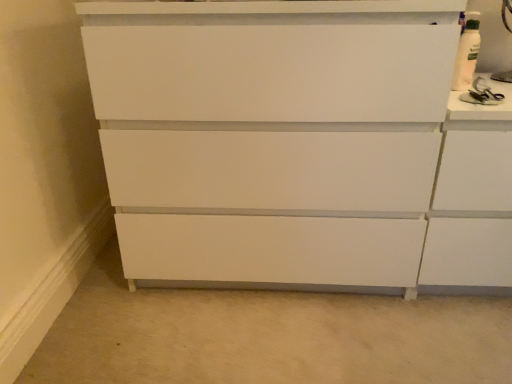
This screenshot has width=512, height=384. Find the location of `vacant space in front of white matte chest of drawers at center`. vacant space in front of white matte chest of drawers at center is located at coordinates (272, 341).